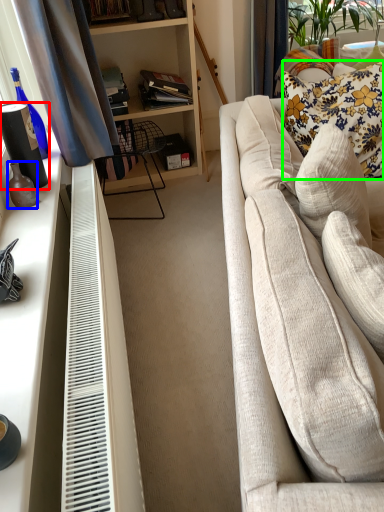
Question: Considering the real-world distances, which object is closest to vase (highlighted by a red box)? bottle (highlighted by a blue box) or pillow (highlighted by a green box).

Choices:
 (A) bottle
 (B) pillow

Answer: (A)